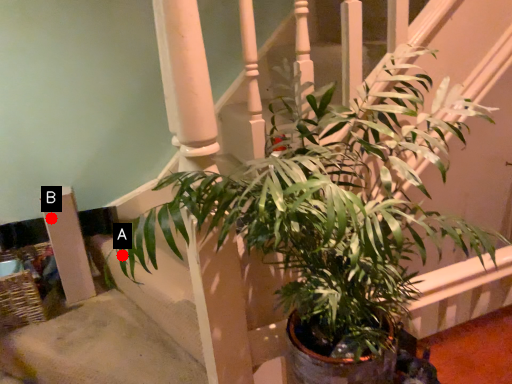
Question: Two points are circled on the image, labeled by A and B beside each circle. Which point is closer to the camera?

Choices:
 (A) A is closer
 (B) B is closer

Answer: (A)